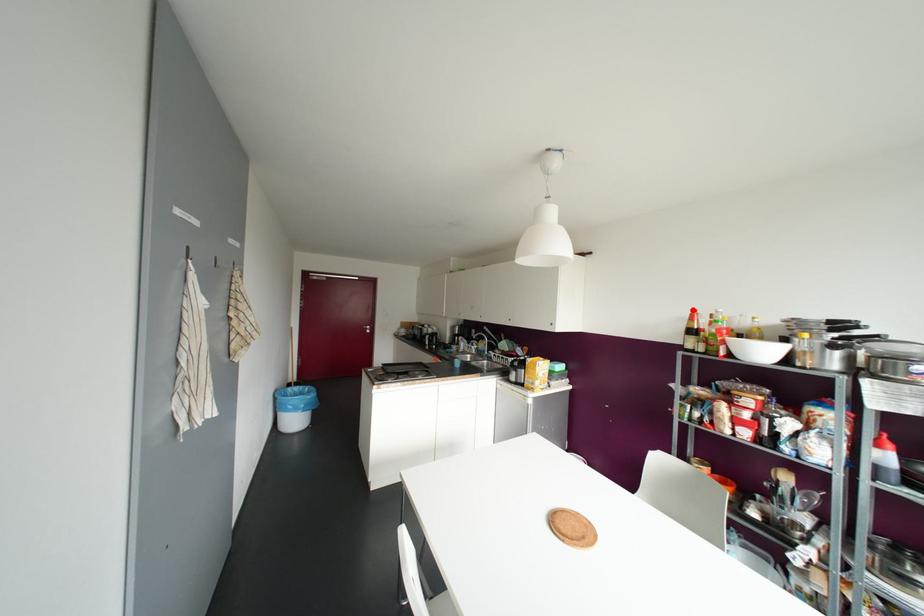
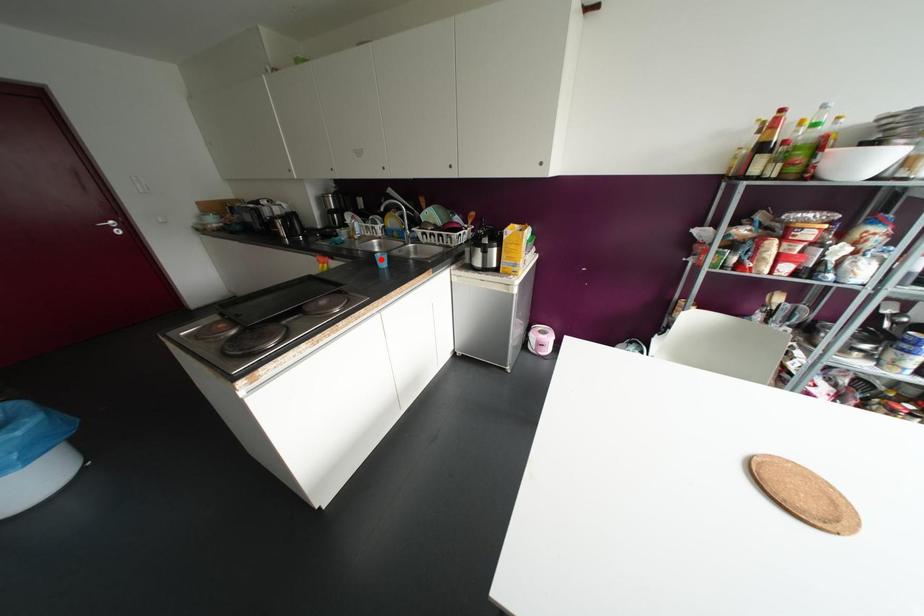
I am providing you with two images of the same scene from different viewpoints. A red point is marked on the first image and another point is marked on the second image. Is the red point in image1 aligned with the point shown in image2?

No